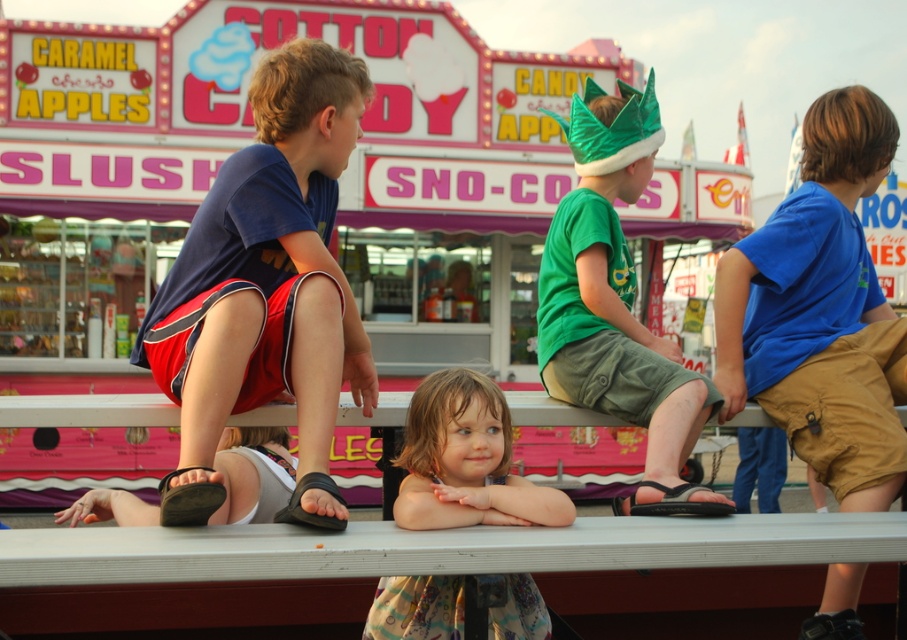
Find the location of a particular element. This screenshot has width=907, height=640. white plastic picnic table at center is located at coordinates (430, 572).

Who is more forward, (901, 525) or (270, 376)?

Positioned in front is point (901, 525).

Identify the location of white plastic picnic table at center. (430, 572).

Can you confirm if white plastic picnic table at center is wider than light brown hair at center?

Yes.

Is point (153, 577) closer to viewer compared to point (563, 506)?

Yes, it is.

This screenshot has height=640, width=907. I want to click on white plastic picnic table at center, so click(x=430, y=572).

Between point (318, 54) and point (480, 477), which one is positioned in front?

Point (480, 477)

Is blue cotton t-shirt at left wider than light brown hair at center?

No.

Locate an element on the screen. The width and height of the screenshot is (907, 640). blue cotton t-shirt at left is located at coordinates (268, 285).

Identify the location of blue cotton t-shirt at left. (268, 285).